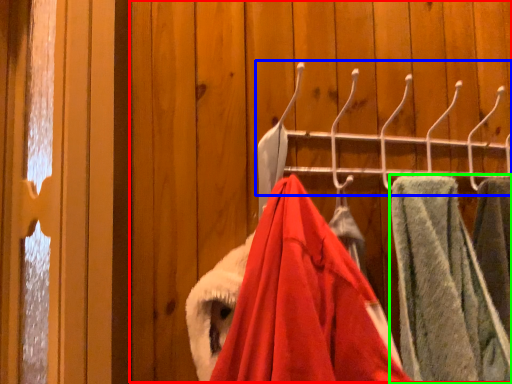
Question: Which is farther away from closet (highlighted by a red box)? closet (highlighted by a blue box) or towel (highlighted by a green box)?

Choices:
 (A) closet
 (B) towel

Answer: (B)